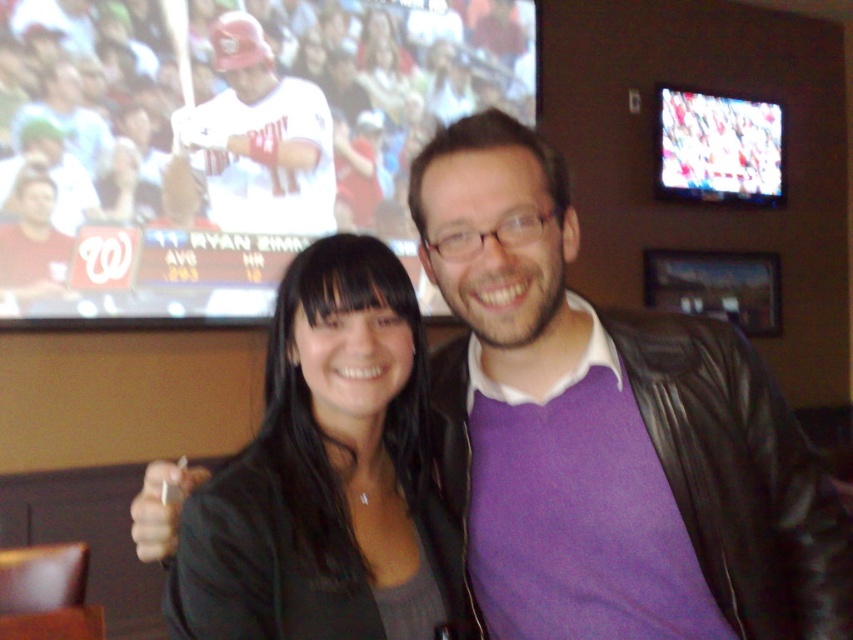
Question: Can you confirm if purple matte sweater at center is positioned below black leather jacket at center?

Choices:
 (A) yes
 (B) no

Answer: (B)

Question: Can you confirm if purple matte sweater at center is positioned below black leather jacket at center?

Choices:
 (A) no
 (B) yes

Answer: (A)

Question: Which object is farther from the camera taking this photo?

Choices:
 (A) matte white jersey at upper left
 (B) black leather jacket at center

Answer: (A)

Question: Does matte white jersey at upper left appear over white matte key at center?

Choices:
 (A) yes
 (B) no

Answer: (A)

Question: Which of the following is the closest to the observer?

Choices:
 (A) matte white jersey at upper left
 (B) purple matte sweater at center
 (C) white matte key at center

Answer: (B)

Question: Which object is the farthest from the matte white jersey at upper left?

Choices:
 (A) black leather jacket at center
 (B) white matte key at center

Answer: (A)